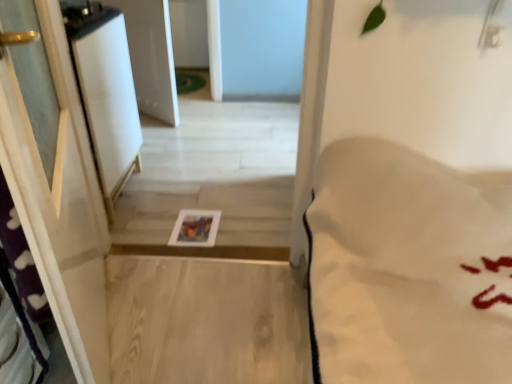
You are a GUI agent. You are given a task and a screenshot of the screen. Output one action in this format:
    pyautogui.click(x=<x>, y=<y>)
    Task: Click on the spots to the right of white glossy screen door at left
    Image resolution: width=512 pixels, height=384 pixels.
    Given the screenshot: What is the action you would take?
    pyautogui.click(x=182, y=194)